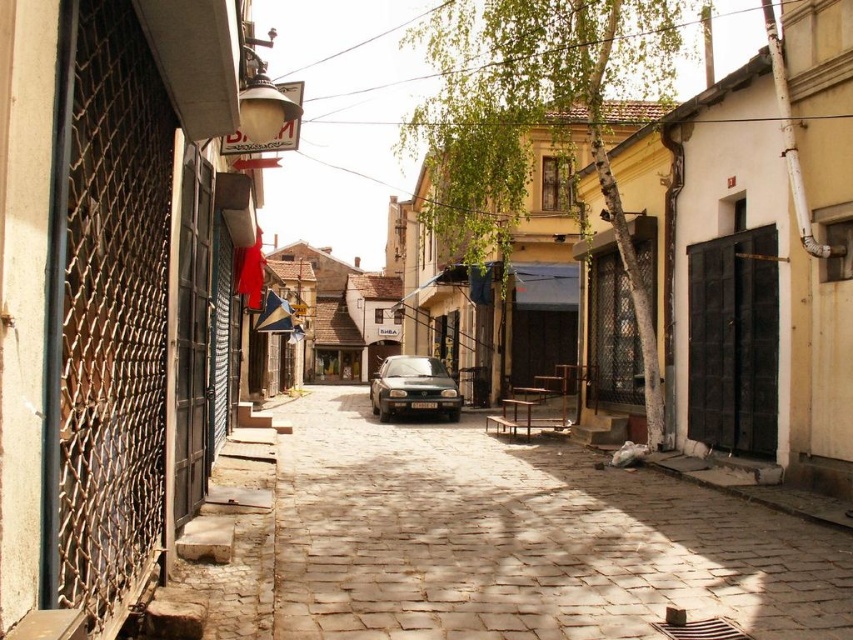
Does brown cobblestone alley at center have a lesser width compared to satin black car at center?

In fact, brown cobblestone alley at center might be wider than satin black car at center.

Looking at this image, can you confirm if brown cobblestone alley at center is bigger than satin black car at center?

No.

This screenshot has width=853, height=640. What do you see at coordinates (521, 540) in the screenshot?
I see `brown cobblestone alley at center` at bounding box center [521, 540].

Where is `brown cobblestone alley at center`? brown cobblestone alley at center is located at coordinates (521, 540).